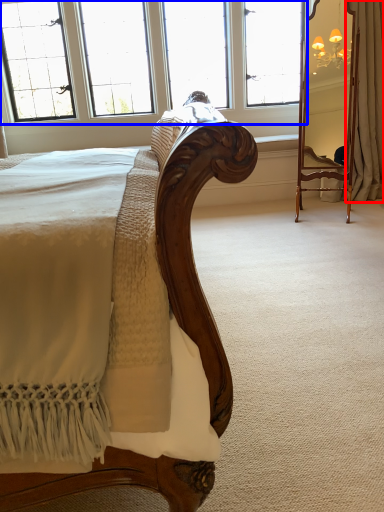
Question: Which object is further to the camera taking this photo, curtain (highlighted by a red box) or window (highlighted by a blue box)?

Choices:
 (A) curtain
 (B) window

Answer: (B)